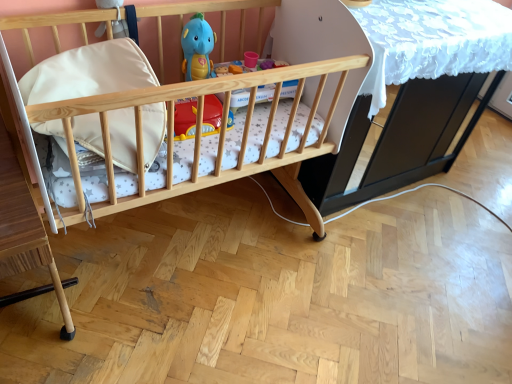
Question: Is natural wood crib at center to the left of white leather pillow at center from the viewer's perspective?

Choices:
 (A) no
 (B) yes

Answer: (A)

Question: Are natural wood crib at center and white leather pillow at center making contact?

Choices:
 (A) no
 (B) yes

Answer: (A)

Question: Is natural wood crib at center not near white leather pillow at center?

Choices:
 (A) no
 (B) yes

Answer: (A)

Question: Would you say natural wood crib at center contains white leather pillow at center?

Choices:
 (A) yes
 (B) no

Answer: (A)

Question: From a real-world perspective, is natural wood crib at center on white leather pillow at center?

Choices:
 (A) yes
 (B) no

Answer: (B)

Question: Is the depth of natural wood crib at center less than that of white leather pillow at center?

Choices:
 (A) yes
 (B) no

Answer: (A)

Question: From a real-world perspective, is white leather pillow at center below matte blue plush toy at upper center?

Choices:
 (A) no
 (B) yes

Answer: (A)

Question: Is white leather pillow at center behind matte blue plush toy at upper center?

Choices:
 (A) no
 (B) yes

Answer: (A)

Question: Does white leather pillow at center have a lesser height compared to matte blue plush toy at upper center?

Choices:
 (A) no
 (B) yes

Answer: (B)

Question: Is white leather pillow at center located outside matte blue plush toy at upper center?

Choices:
 (A) yes
 (B) no

Answer: (A)

Question: Is white leather pillow at center touching matte blue plush toy at upper center?

Choices:
 (A) no
 (B) yes

Answer: (A)

Question: Is white leather pillow at center facing towards matte blue plush toy at upper center?

Choices:
 (A) yes
 (B) no

Answer: (B)

Question: Is natural wood crib at center taller than white lace table at center?

Choices:
 (A) no
 (B) yes

Answer: (B)